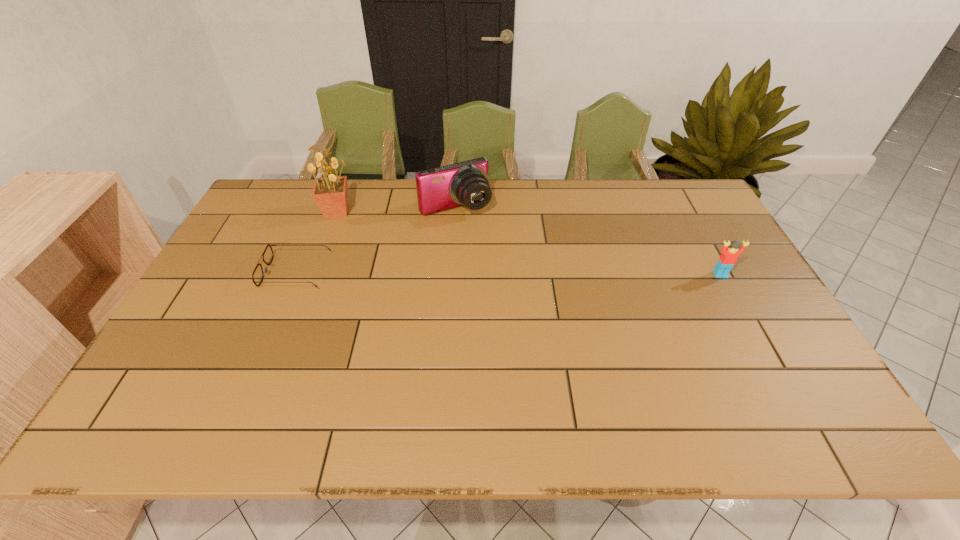
What are the coordinates of `sunglasses` in the screenshot? It's located at (257, 276).

What are the coordinates of `the rightmost object` in the screenshot? It's located at (728, 258).

Find the location of a particular element. The height and width of the screenshot is (540, 960). Lego is located at coordinates (728, 258).

Identify the location of the second tallest object. [x=466, y=183].

Image resolution: width=960 pixels, height=540 pixels. What are the coordinates of `camera` in the screenshot? It's located at (466, 183).

Image resolution: width=960 pixels, height=540 pixels. I want to click on the tallest object, so click(x=330, y=193).

Where is `free space located on the front-facing side of the sunglasses`? free space located on the front-facing side of the sunglasses is located at coordinates (225, 272).

At what (x,y) coordinates should I click in order to perform the action: click on vacant space positioned on the front-facing side of the sunglasses. Please return your answer as a coordinate pair (x, y). Looking at the image, I should click on (228, 272).

I want to click on free region located on the face of the third tallest object, so click(753, 335).

The height and width of the screenshot is (540, 960). I want to click on blank space located on the front-facing side of the camera, so click(510, 279).